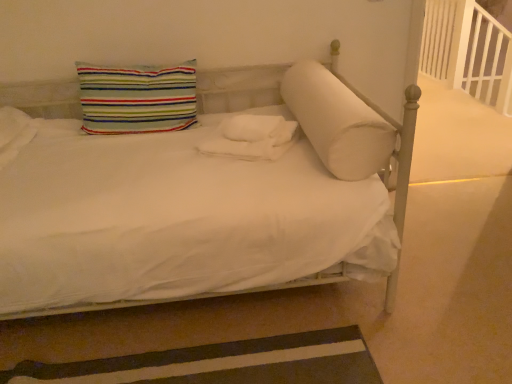
Question: Does point (364, 144) appear closer or farther from the camera than point (300, 365)?

Choices:
 (A) closer
 (B) farther

Answer: (A)

Question: In terms of height, does white soft cylindrical pillow at center, the 2th pillow viewed from the left, look taller or shorter compared to brown striped rug at lower left?

Choices:
 (A) tall
 (B) short

Answer: (A)

Question: Considering the real-world distances, which object is farthest from the brown striped rug at lower left?

Choices:
 (A) striped fabric pillow at upper left, the 2th pillow when ordered from right to left
 (B) white wooden balustrade at upper right
 (C) white fluffy blanket at center
 (D) white soft cylindrical pillow at center, the 2th pillow viewed from the left

Answer: (B)

Question: Which is farther from the white wooden balustrade at upper right?

Choices:
 (A) white fluffy blanket at center
 (B) white soft cylindrical pillow at center, the 2th pillow viewed from the left
 (C) brown striped rug at lower left
 (D) striped fabric pillow at upper left, the 2th pillow when ordered from right to left

Answer: (C)